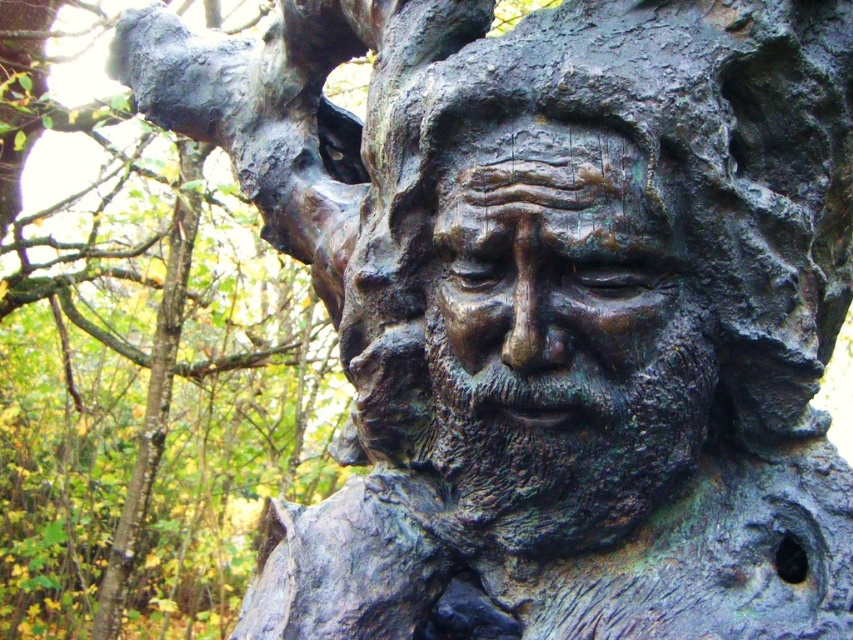
You are an art conservator examining the sculpture. You need to determine which part of the sculpture is taller between the bronze textured face at center and the green patina bark at upper right. Based on the description, which one is taller?

The bronze textured face at center has a lesser height compared to green patina bark at upper right, so the green patina bark at upper right is taller.

You are an art conservator assessing the sculpture. You notice the bronze textured face at center and the green patina bark at upper right. Which object is wider?

The bronze textured face at center has a lesser width compared to green patina bark at upper right, so the green patina bark at upper right is wider.